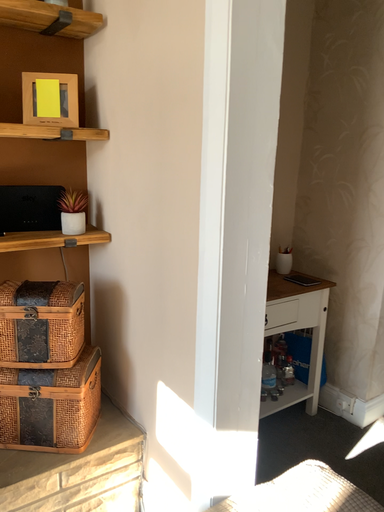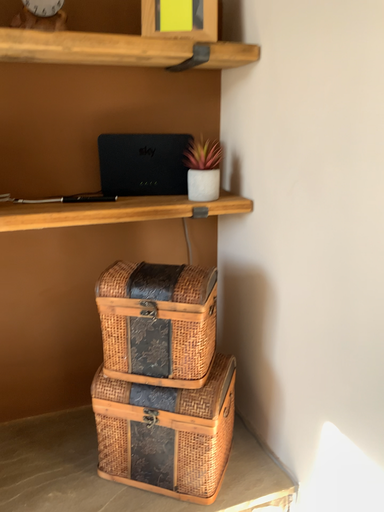
Question: Which way did the camera rotate in the video?

Choices:
 (A) rotated right
 (B) rotated left

Answer: (B)